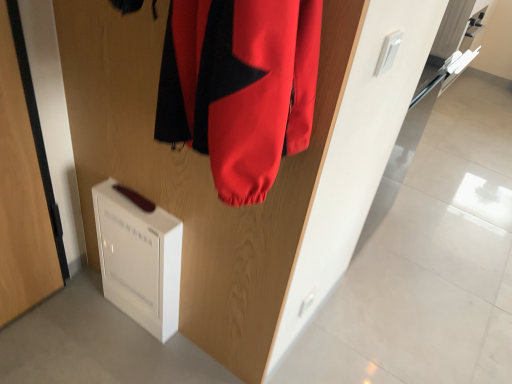
You are a GUI agent. You are given a task and a screenshot of the screen. Output one action in this format:
    pyautogui.click(x=<x>, y=<y>)
    Task: Click on the free space between white matte door at lower left, the 2th door positioned from the right, and wooden door at center, placed as the 1th door when sorted from right to left
    The width and height of the screenshot is (512, 384).
    Given the screenshot: What is the action you would take?
    pyautogui.click(x=110, y=329)